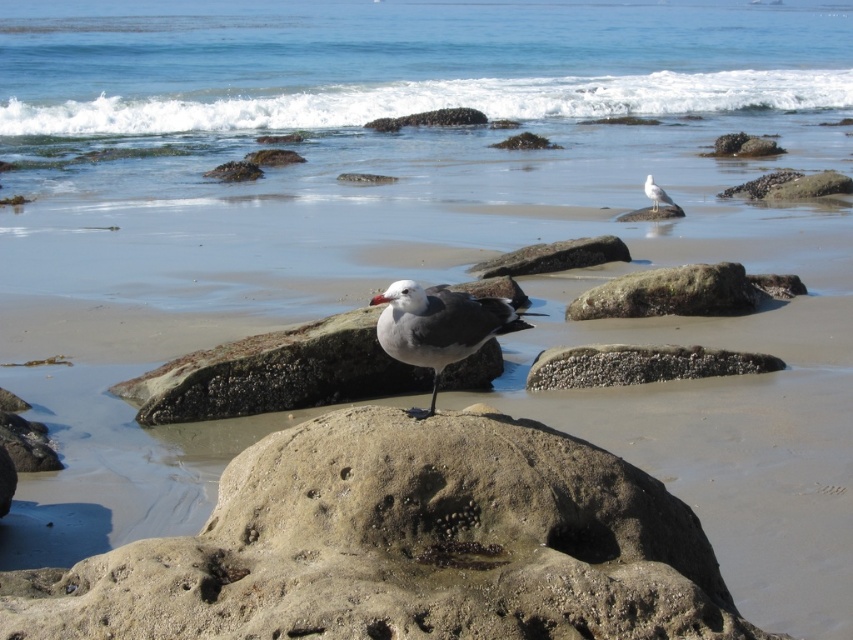
Question: Can you confirm if smooth sandstone rock at center is positioned to the left of smooth gray rock at center?

Choices:
 (A) yes
 (B) no

Answer: (B)

Question: Can you confirm if smooth sandstone rock at center is smaller than smooth gray rock at center?

Choices:
 (A) no
 (B) yes

Answer: (B)

Question: Where is gray matte seagull at center located in relation to smooth gray rock at upper right in the image?

Choices:
 (A) left
 (B) right

Answer: (A)

Question: Which of the following is the farthest from the observer?

Choices:
 (A) blue water at upper center
 (B) gray matte seagull at center
 (C) white matte seagull at upper right
 (D) smooth sandstone rock at center

Answer: (A)

Question: Which point is closer to the camera taking this photo?

Choices:
 (A) (405, 193)
 (B) (788, 186)
 (C) (628, 260)
 (D) (541, 360)

Answer: (D)

Question: Which point is closer to the camera?

Choices:
 (A) blue water at upper center
 (B) white matte seagull at upper right
 (C) smooth gray rock at upper right
 (D) smooth gray rock at center

Answer: (D)